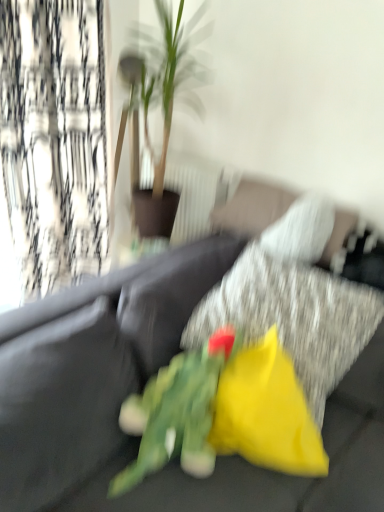
Question: Is green fabric flower at center positioned beyond the bounds of black textured curtain at left?

Choices:
 (A) yes
 (B) no

Answer: (A)

Question: From the image's perspective, is green fabric flower at center below black textured curtain at left?

Choices:
 (A) yes
 (B) no

Answer: (A)

Question: Is the position of green fabric flower at center less distant than that of black textured curtain at left?

Choices:
 (A) yes
 (B) no

Answer: (A)

Question: Does green fabric flower at center have a greater height compared to black textured curtain at left?

Choices:
 (A) yes
 (B) no

Answer: (B)

Question: Considering the relative sizes of green fabric flower at center and black textured curtain at left in the image provided, is green fabric flower at center thinner than black textured curtain at left?

Choices:
 (A) yes
 (B) no

Answer: (B)

Question: From a real-world perspective, is green leafy plant at center positioned above or below velvet dark gray couch at center?

Choices:
 (A) above
 (B) below

Answer: (A)

Question: In the image, is green leafy plant at center on the left side or the right side of velvet dark gray couch at center?

Choices:
 (A) right
 (B) left

Answer: (B)

Question: From the image's perspective, is green leafy plant at center positioned above or below velvet dark gray couch at center?

Choices:
 (A) below
 (B) above

Answer: (B)

Question: Considering the positions of green leafy plant at center and velvet dark gray couch at center in the image, is green leafy plant at center bigger or smaller than velvet dark gray couch at center?

Choices:
 (A) small
 (B) big

Answer: (A)

Question: Looking at their shapes, would you say velvet dark gray couch at center is wider or thinner than green fabric flower at center?

Choices:
 (A) thin
 (B) wide

Answer: (B)

Question: Is velvet dark gray couch at center bigger or smaller than green fabric flower at center?

Choices:
 (A) big
 (B) small

Answer: (A)

Question: From a real-world perspective, is velvet dark gray couch at center physically located above or below green fabric flower at center?

Choices:
 (A) below
 (B) above

Answer: (A)

Question: Would you say velvet dark gray couch at center is inside or outside green fabric flower at center?

Choices:
 (A) outside
 (B) inside

Answer: (A)

Question: In the image, is green leafy plant at center on the left side or the right side of black textured curtain at left?

Choices:
 (A) right
 (B) left

Answer: (A)

Question: From a real-world perspective, is green leafy plant at center physically located above or below black textured curtain at left?

Choices:
 (A) below
 (B) above

Answer: (B)